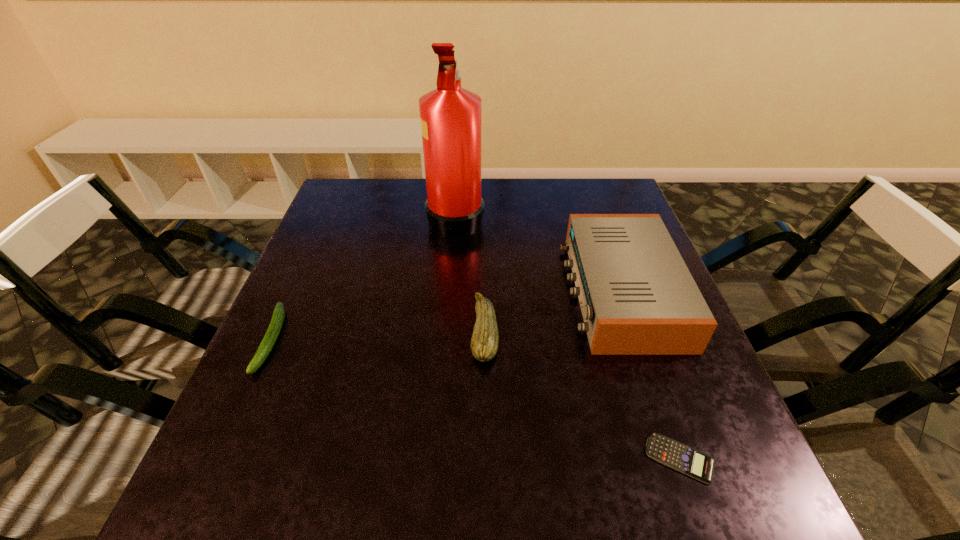
Locate an element on the screen. the tallest object is located at coordinates (450, 115).

This screenshot has height=540, width=960. In order to click on radio receiver in this screenshot , I will do `click(637, 297)`.

Locate an element on the screen. This screenshot has width=960, height=540. the third shortest object is located at coordinates (484, 344).

Where is `the right zucchini`? the right zucchini is located at coordinates (484, 344).

What are the coordinates of `the left zucchini` in the screenshot? It's located at point(272,333).

I want to click on the shorter zucchini, so (272, 333).

Where is `calculator`? This screenshot has height=540, width=960. calculator is located at coordinates 678,456.

At what (x,y) coordinates should I click in order to perform the action: click on the shortest object. Please return your answer as a coordinate pair (x, y). The width and height of the screenshot is (960, 540). Looking at the image, I should click on (678, 456).

Identify the location of vacant area situated 0.320m at the spray nozzle of the fire extinguisher. The height and width of the screenshot is (540, 960). (596, 216).

Find the location of a particular element. vacant space located 0.220m on the front panel of the second tallest object is located at coordinates (474, 291).